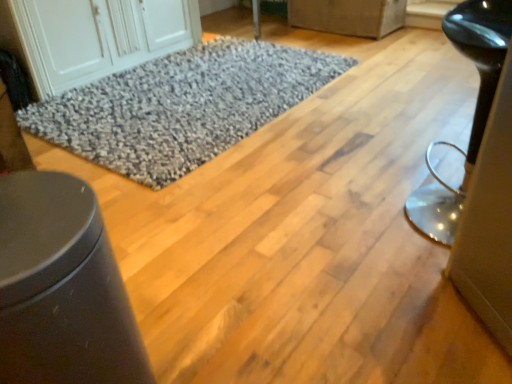
At what (x,y) coordinates should I click in order to perform the action: click on free space above matte black trash can at lower left, the third furniture from the right (from a real-world perspective). Please return your answer as a coordinate pair (x, y). This screenshot has width=512, height=384. Looking at the image, I should click on point(40,216).